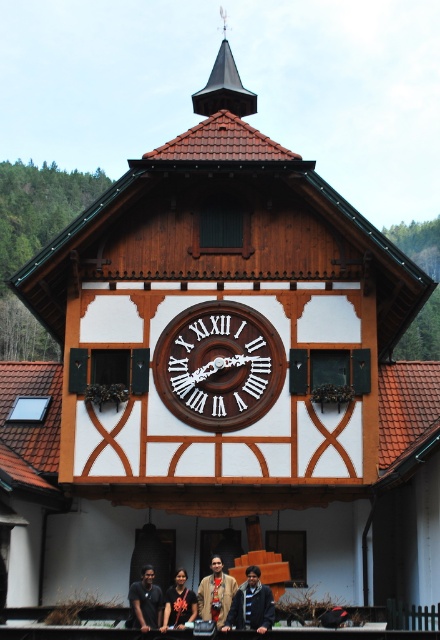
From the picture: Which of these two, dark blue jacket at lower center or dark brown shirt at center, stands taller?

dark blue jacket at lower center is taller.

Who is more forward, (252,576) or (146,593)?

Point (252,576) is more forward.

Locate an element on the screen. dark blue jacket at lower center is located at coordinates (250, 604).

Can you confirm if dark brown shirt at center is smaller than dark blue shirt at lower center?

Yes.

Between point (135, 588) and point (165, 609), which one is positioned behind?

Point (165, 609)

The width and height of the screenshot is (440, 640). What do you see at coordinates (146, 602) in the screenshot?
I see `dark brown shirt at center` at bounding box center [146, 602].

Where is `dark brown shirt at center`? Image resolution: width=440 pixels, height=640 pixels. dark brown shirt at center is located at coordinates (146, 602).

Does wooden clock at center lie behind dark blue shirt at lower center?

Yes, wooden clock at center is behind dark blue shirt at lower center.

Which of these two, wooden clock at center or dark blue shirt at lower center, stands shorter?

wooden clock at center

Does point (259, 403) come in front of point (189, 616)?

No, it is not.

Identify the location of wooden clock at center. The image size is (440, 640). (219, 365).